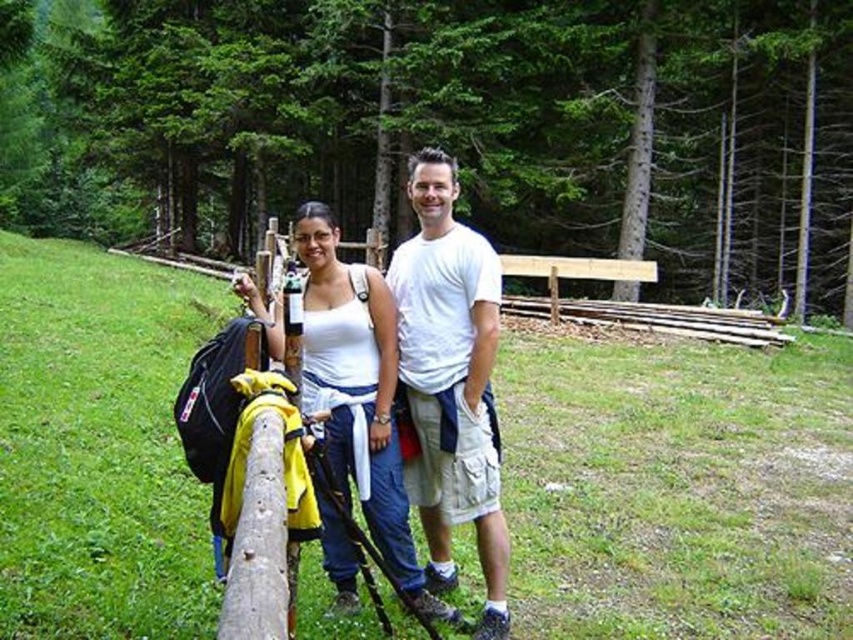
Is white cotton t-shirt at center taller than white cotton tank top at center?

Indeed, white cotton t-shirt at center has a greater height compared to white cotton tank top at center.

Is white cotton t-shirt at center below white cotton tank top at center?

No.

Describe the element at coordinates (451, 381) in the screenshot. I see `white cotton t-shirt at center` at that location.

Where is `white cotton t-shirt at center`? This screenshot has height=640, width=853. white cotton t-shirt at center is located at coordinates (451, 381).